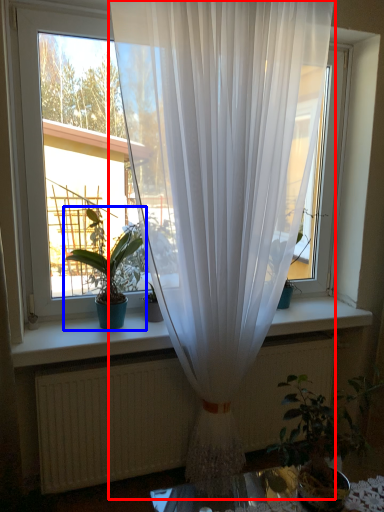
Question: Which object is further to the camera taking this photo, curtain (highlighted by a red box) or houseplant (highlighted by a blue box)?

Choices:
 (A) curtain
 (B) houseplant

Answer: (B)